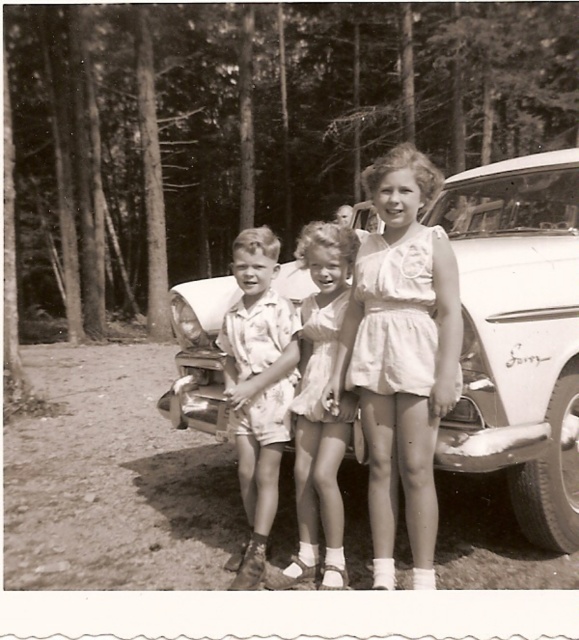
Question: Which point appears farthest from the camera in this image?

Choices:
 (A) (195, 289)
 (B) (228, 568)

Answer: (A)

Question: Which object is farther from the camera taking this photo?

Choices:
 (A) floral fabric shorts at center
 (B) matte white dress at center
 (C) white cotton dress at center
 (D) white glossy car at center

Answer: (A)

Question: Does white cotton dress at center have a lesser width compared to matte white dress at center?

Choices:
 (A) yes
 (B) no

Answer: (B)

Question: Which is nearer to the white glossy car at center?

Choices:
 (A) white cotton dress at center
 (B) matte white dress at center
 (C) floral fabric shorts at center

Answer: (A)

Question: Does white cotton dress at center have a larger size compared to matte white dress at center?

Choices:
 (A) no
 (B) yes

Answer: (B)

Question: Is floral fabric shorts at center positioned before matte white dress at center?

Choices:
 (A) no
 (B) yes

Answer: (A)